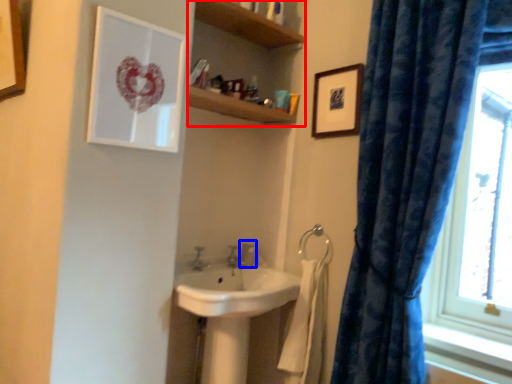
Question: Which object is further to the camera taking this photo, bookshelf (highlighted by a red box) or plumbing fixture (highlighted by a blue box)?

Choices:
 (A) bookshelf
 (B) plumbing fixture

Answer: (B)